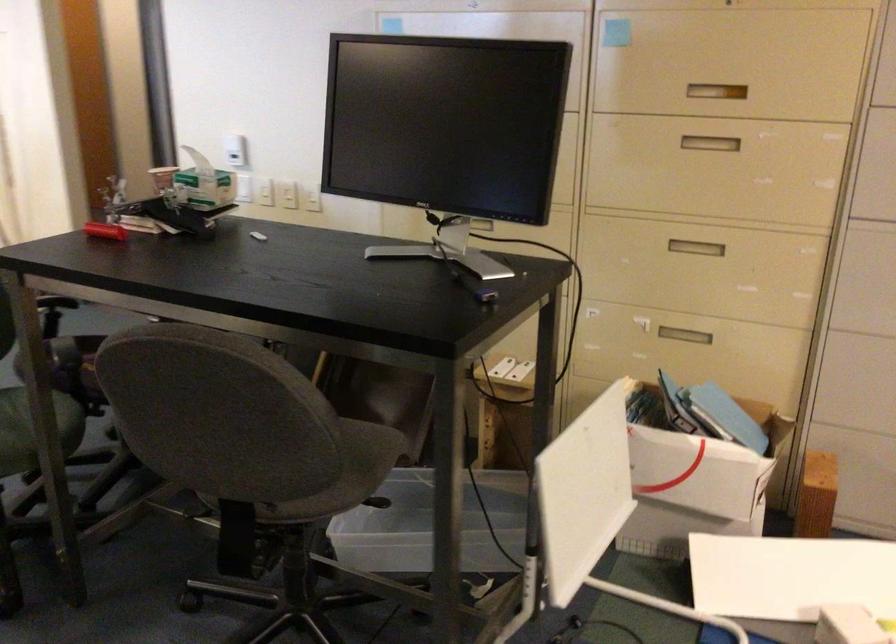
Identify the location of red stapler. This screenshot has width=896, height=644. (104, 231).